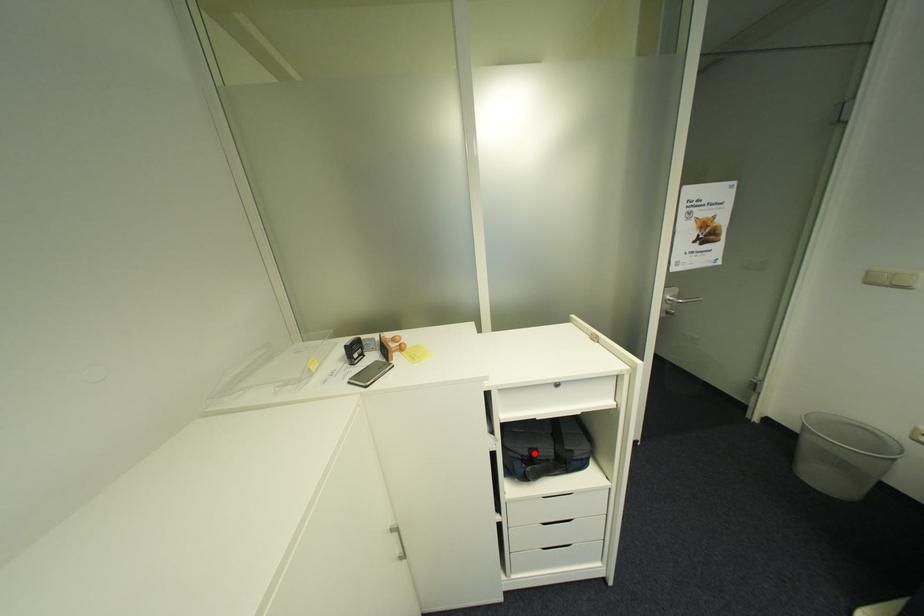
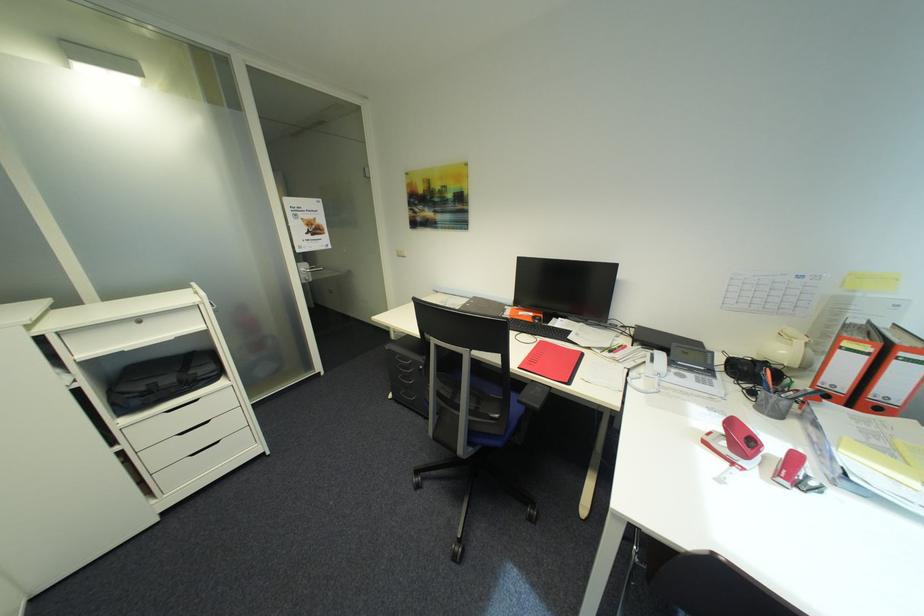
Question: I am providing you with two images of the same scene from different viewpoints. A red point is shown in image1. For the corresponding object point in image2, is it positioned nearer or farther from the camera?

Choices:
 (A) Nearer
 (B) Farther

Answer: (A)